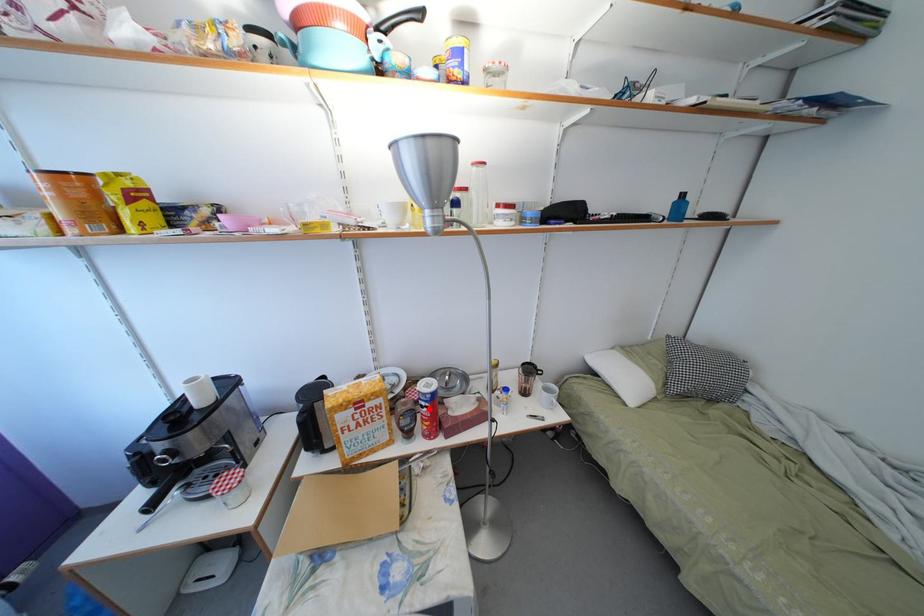
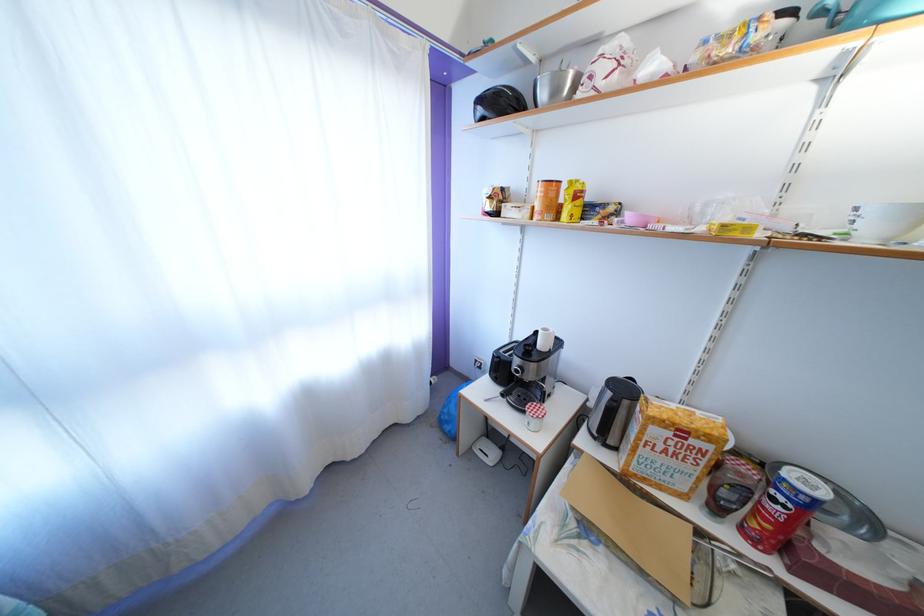
Question: I am providing you with two images of the same scene from different viewpoints. A red point is shown in image1. For the corresponding object point in image2, is it positioned nearer or farther from the camera?

Choices:
 (A) Nearer
 (B) Farther

Answer: (A)